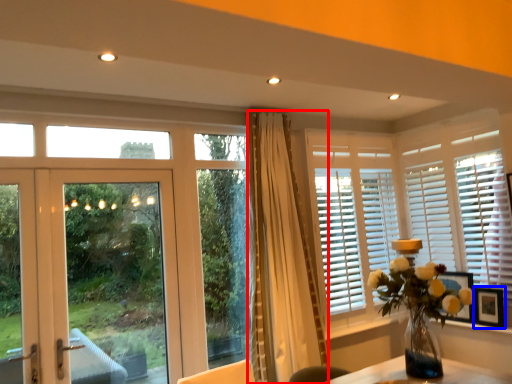
Question: Which point is further to the camera, curtain (highlighted by a red box) or picture frame (highlighted by a blue box)?

Choices:
 (A) curtain
 (B) picture frame

Answer: (B)